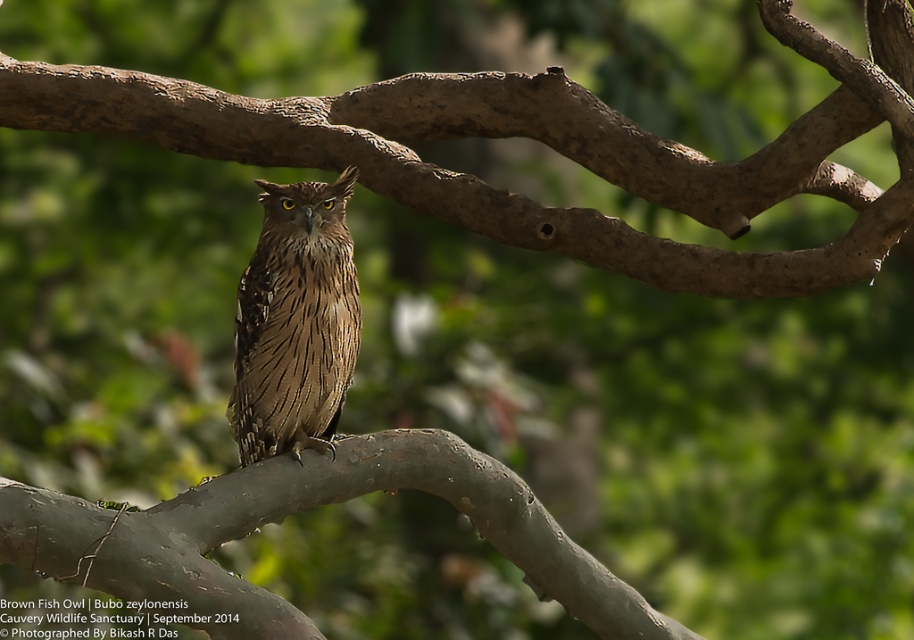
Between point (287, 144) and point (481, 481), which one is positioned behind?

The point (287, 144) is more distant.

Which is behind, point (388, 156) or point (603, 628)?

Positioned behind is point (388, 156).

Where is `brown wood tree branch at center`? The width and height of the screenshot is (914, 640). brown wood tree branch at center is located at coordinates (548, 145).

Can you confirm if brown wood tree branch at center is positioned below brown feathered owl at center?

Actually, brown wood tree branch at center is above brown feathered owl at center.

Which is more to the left, brown wood tree branch at center or brown feathered owl at center?

brown feathered owl at center is more to the left.

Is point (465, 193) farther from camera compared to point (282, 278)?

Yes, point (465, 193) is farther from viewer.

Identify the location of brown wood tree branch at center. The width and height of the screenshot is (914, 640). (548, 145).

Consider the image. Does brown matte branch at center come behind brown feathered owl at center?

That is False.

Does point (401, 432) come behind point (258, 349)?

That is True.

Where is `brown matte branch at center`? brown matte branch at center is located at coordinates (300, 509).

I want to click on brown matte branch at center, so click(x=300, y=509).